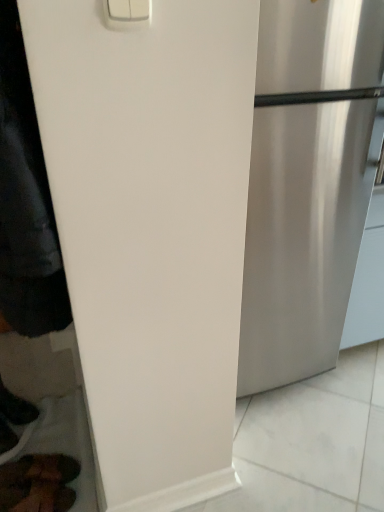
Question: Do you think black leather shoe at lower left is within brown leather shoes at lower left, or outside of it?

Choices:
 (A) outside
 (B) inside

Answer: (A)

Question: Based on their positions, is black leather shoe at lower left located to the left or right of brown leather shoes at lower left?

Choices:
 (A) left
 (B) right

Answer: (A)

Question: Which object is the farthest from the black leather shoe at lower left?

Choices:
 (A) brown leather shoes at lower left
 (B) black matte jacket at left
 (C) satin silver refrigerator at right

Answer: (C)

Question: Which object is positioned closest to the black matte jacket at left?

Choices:
 (A) black leather shoe at lower left
 (B) satin silver refrigerator at right
 (C) brown leather shoes at lower left

Answer: (B)